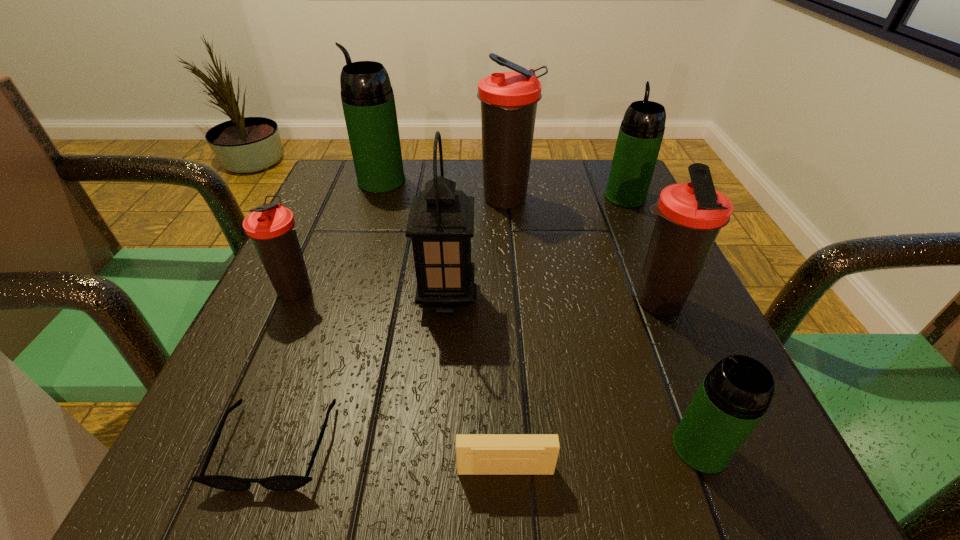
Where is `object at the far right corner`? The image size is (960, 540). object at the far right corner is located at coordinates (641, 132).

This screenshot has width=960, height=540. Identify the location of object at the near right corner. (734, 396).

Locate an element on the screen. free region at the far edge is located at coordinates (483, 197).

Locate an element on the screen. The width and height of the screenshot is (960, 540). vacant position at the near edge of the desktop is located at coordinates (432, 447).

The height and width of the screenshot is (540, 960). I want to click on blank space at the left edge of the desktop, so click(346, 233).

Locate an element on the screen. Image resolution: width=960 pixels, height=540 pixels. free space at the right edge of the desktop is located at coordinates (616, 291).

Where is `free point at the near left corner`? Image resolution: width=960 pixels, height=540 pixels. free point at the near left corner is located at coordinates (269, 434).

This screenshot has height=540, width=960. In the image, there is a desktop. Find the location of `free space at the far right corner`. free space at the far right corner is located at coordinates (595, 197).

Locate an element on the screen. This screenshot has height=540, width=960. vacant space that's between the biggest brown thermos bottle and the sunglasses is located at coordinates (392, 322).

Where is `vacant area between the biggest brown thermos bottle and the leftmost brown thermos bottle`? This screenshot has width=960, height=540. vacant area between the biggest brown thermos bottle and the leftmost brown thermos bottle is located at coordinates (402, 245).